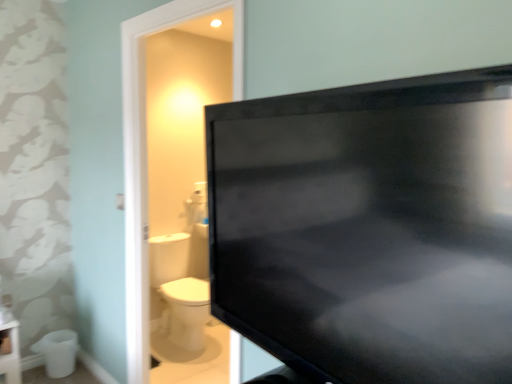
Question: Is white glossy toilet bowl at lower left bigger than black glossy tv at upper right?

Choices:
 (A) yes
 (B) no

Answer: (B)

Question: Does white glossy toilet bowl at lower left contain black glossy tv at upper right?

Choices:
 (A) no
 (B) yes

Answer: (A)

Question: Considering the relative sizes of white glossy toilet bowl at lower left and black glossy tv at upper right in the image provided, is white glossy toilet bowl at lower left thinner than black glossy tv at upper right?

Choices:
 (A) no
 (B) yes

Answer: (A)

Question: From the image's perspective, is white glossy toilet bowl at lower left below black glossy tv at upper right?

Choices:
 (A) yes
 (B) no

Answer: (A)

Question: Are white glossy toilet bowl at lower left and black glossy tv at upper right making contact?

Choices:
 (A) yes
 (B) no

Answer: (B)

Question: Considering the relative sizes of white glossy toilet bowl at lower left and black glossy tv at upper right in the image provided, is white glossy toilet bowl at lower left shorter than black glossy tv at upper right?

Choices:
 (A) no
 (B) yes

Answer: (B)

Question: Is black glossy tv at upper right to the left of white glossy toilet bowl at lower left from the viewer's perspective?

Choices:
 (A) yes
 (B) no

Answer: (B)

Question: Is black glossy tv at upper right aimed at white glossy toilet bowl at lower left?

Choices:
 (A) no
 (B) yes

Answer: (A)

Question: Is white glossy toilet bowl at lower left inside black glossy tv at upper right?

Choices:
 (A) yes
 (B) no

Answer: (B)

Question: Can you confirm if black glossy tv at upper right is smaller than white glossy toilet bowl at lower left?

Choices:
 (A) no
 (B) yes

Answer: (A)

Question: Can you confirm if black glossy tv at upper right is positioned to the right of white glossy toilet bowl at lower left?

Choices:
 (A) yes
 (B) no

Answer: (A)

Question: Is black glossy tv at upper right not near white glossy toilet bowl at lower left?

Choices:
 (A) yes
 (B) no

Answer: (A)

Question: Do you think white glossy toilet bowl at lower left is within black glossy tv at upper right, or outside of it?

Choices:
 (A) outside
 (B) inside

Answer: (A)